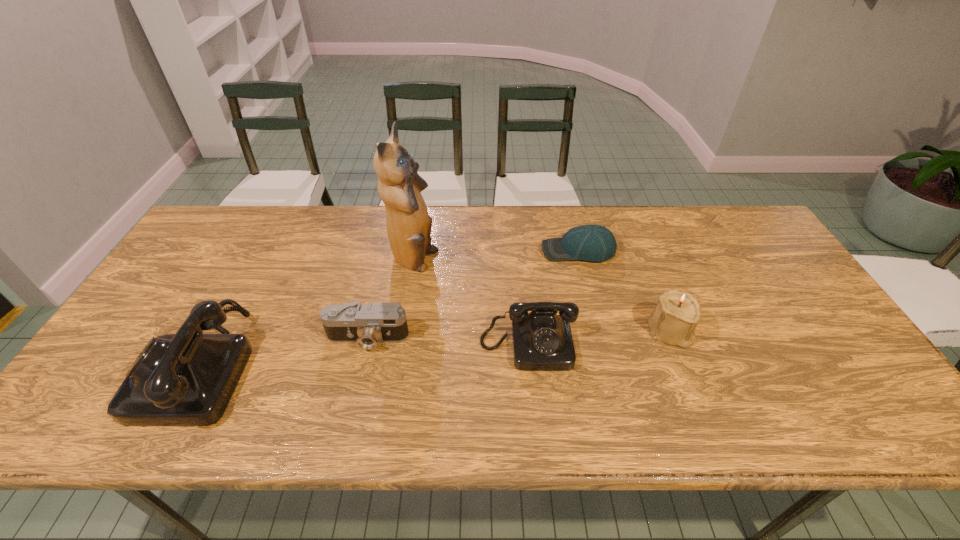
Please show where to add a telephone on the right while keeping spacing even. Please provide its 2D coordinates. Your answer should be formatted as a tuple, i.e. [(x, y)], where the tuple contains the x and y coordinates of a point satisfying the conditions above.

[(834, 328)]